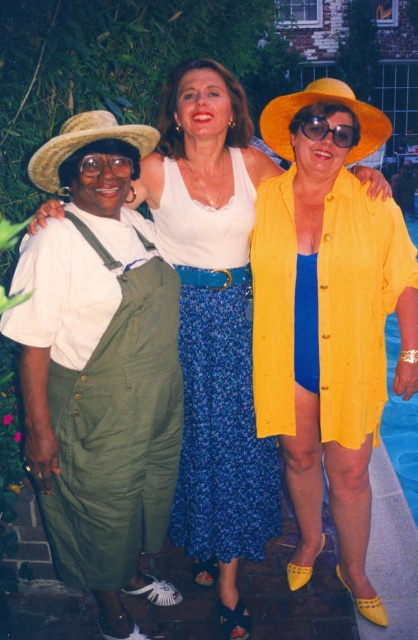
Is blue smooth water at lower right closer to the viewer compared to matte yellow sunglasses at center?

No, it is behind matte yellow sunglasses at center.

How much distance is there between blue smooth water at lower right and matte yellow sunglasses at center?

blue smooth water at lower right is 2.13 meters from matte yellow sunglasses at center.

Image resolution: width=418 pixels, height=640 pixels. Find the location of `blue smooth water at lower right`. blue smooth water at lower right is located at coordinates (400, 424).

Is blue floral fabric dress at center taller than matte yellow sunglasses at center?

Yes.

Image resolution: width=418 pixels, height=640 pixels. What do you see at coordinates (216, 376) in the screenshot? I see `blue floral fabric dress at center` at bounding box center [216, 376].

Where is `blue floral fabric dress at center`? This screenshot has height=640, width=418. blue floral fabric dress at center is located at coordinates (216, 376).

Is point (412, 230) farther from camera compared to point (104, 170)?

Yes, it is.

Does blue smooth water at lower right appear over matte black goggles at upper left?

Yes, blue smooth water at lower right is above matte black goggles at upper left.

Locate an element on the screen. This screenshot has width=418, height=640. blue smooth water at lower right is located at coordinates (400, 424).

Identify the location of blue smooth water at lower right. (400, 424).